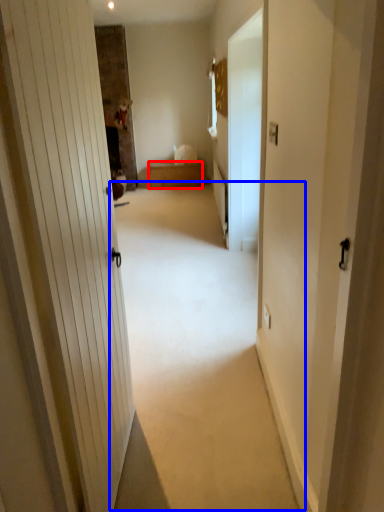
Question: Which point is closer to the camera, furniture (highlighted by a red box) or plain (highlighted by a blue box)?

Choices:
 (A) furniture
 (B) plain

Answer: (B)